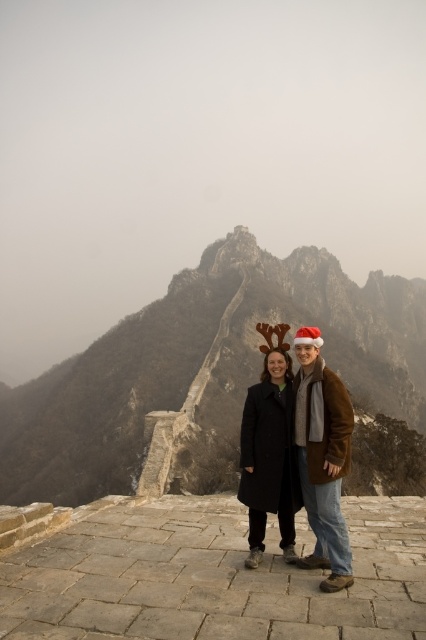
Question: Is matte black coat at center bigger than black wool coat at center?

Choices:
 (A) yes
 (B) no

Answer: (B)

Question: Which is farther from the rugged stone wall at center?

Choices:
 (A) black wool coat at center
 (B) matte black coat at center

Answer: (B)

Question: Which object is farther from the camera taking this photo?

Choices:
 (A) black wool coat at center
 (B) rugged stone wall at center

Answer: (B)

Question: Is rugged stone wall at center to the left of black wool coat at center from the viewer's perspective?

Choices:
 (A) no
 (B) yes

Answer: (A)

Question: Is rugged stone wall at center bigger than matte black coat at center?

Choices:
 (A) yes
 (B) no

Answer: (A)

Question: Which point is closer to the camera?

Choices:
 (A) rugged stone wall at center
 (B) black wool coat at center

Answer: (B)